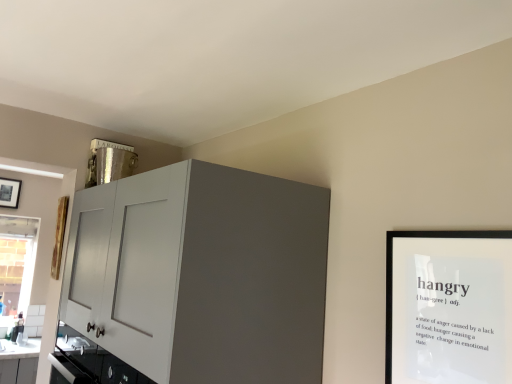
Question: Looking at the image, does black matte picture frame at upper right seem bigger or smaller compared to matte white cabinet at upper left?

Choices:
 (A) small
 (B) big

Answer: (A)

Question: From the image's perspective, is black matte picture frame at upper right positioned above or below matte white cabinet at upper left?

Choices:
 (A) below
 (B) above

Answer: (B)

Question: Which of these objects is positioned farthest from the matte white cabinet at upper left?

Choices:
 (A) clear glass window at lower left
 (B) black matte picture frame at upper right

Answer: (A)

Question: Considering the real-world distances, which object is farthest from the matte white cabinet at upper left?

Choices:
 (A) clear glass window at lower left
 (B) black matte picture frame at upper right

Answer: (A)